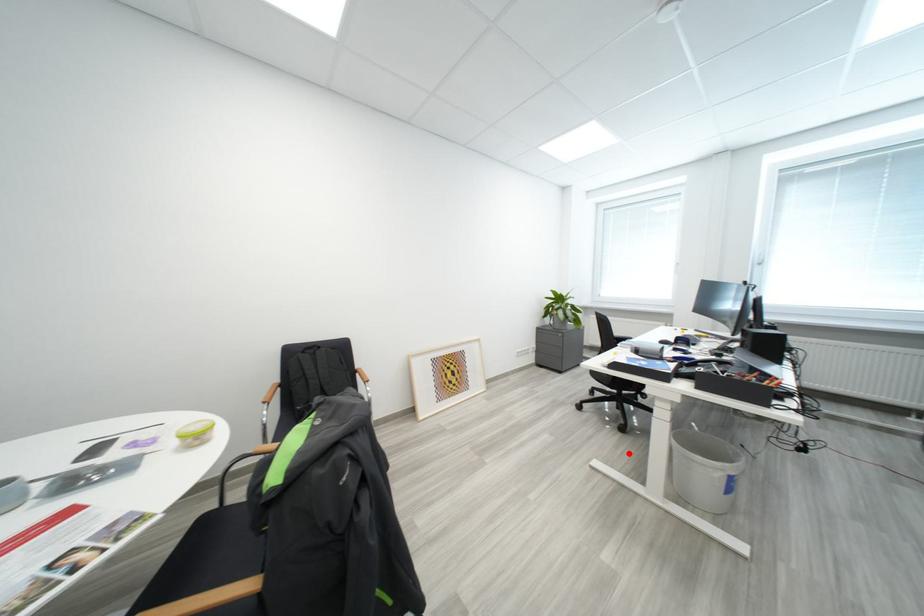
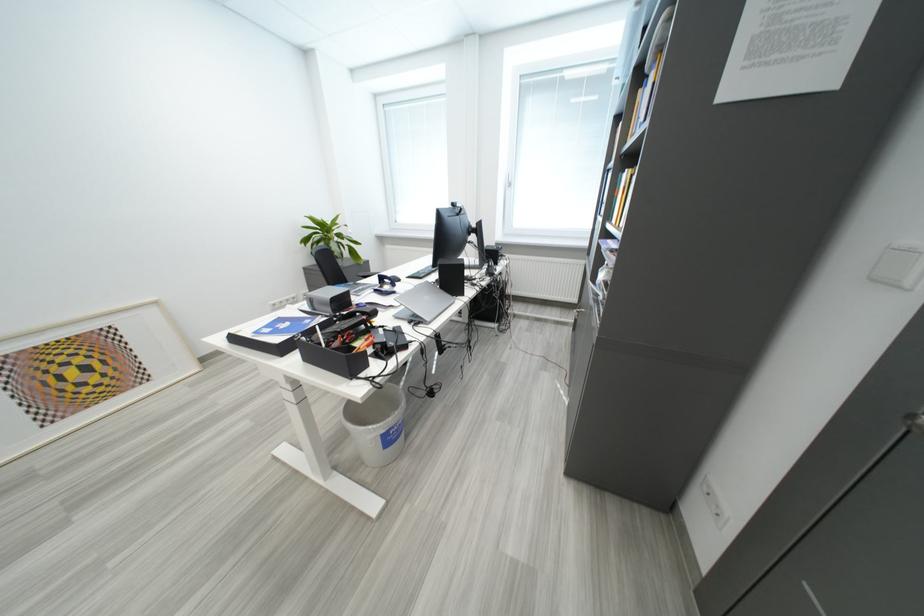
Question: A red point is marked in image1. In image2, is the corresponding 3D point closer to the camera or farther? Reply with the corresponding letter.

Choices:
 (A) The corresponding 3D point is closer.
 (B) The corresponding 3D point is farther.

Answer: (B)